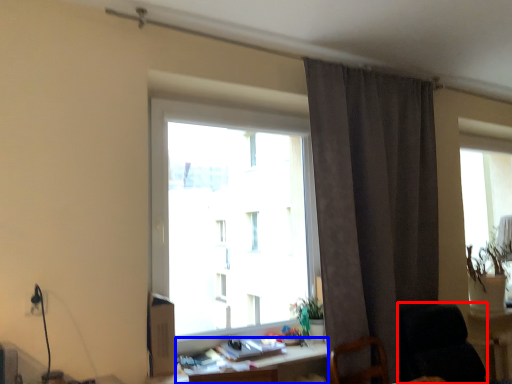
Question: Which of the following is the closest to the observer, rocking chair (highlighted by a red box) or table (highlighted by a blue box)?

Choices:
 (A) rocking chair
 (B) table

Answer: (B)